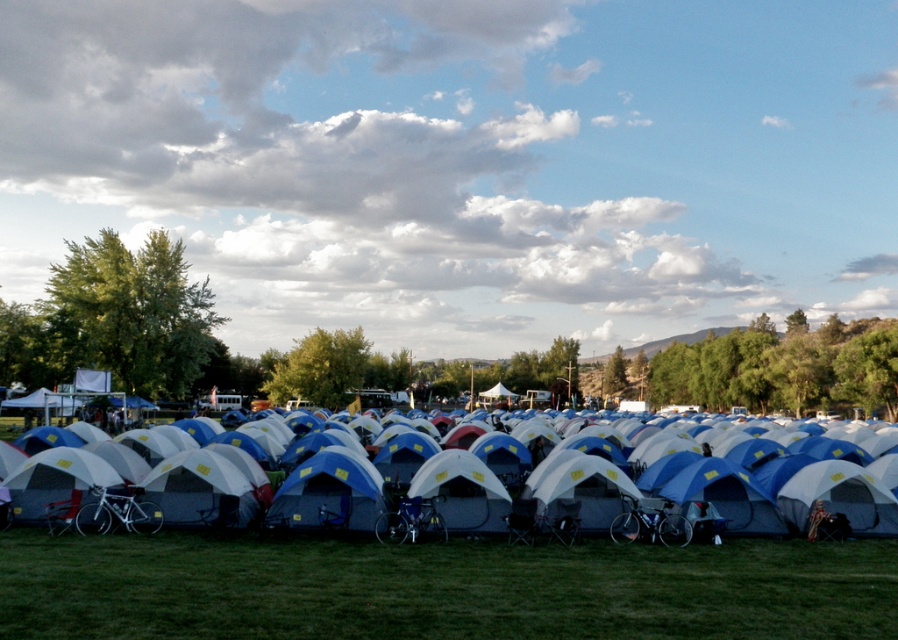
You are planning to set up a small picnic blanket in the camping area. Given the presence of the green grass at lower center and the white fabric tent at center, which area would be more suitable for placing the picnic blanket without obstructing the tents?

A: The green grass at lower center is more suitable because it has a smaller size compared to the white fabric tent at center, meaning there is enough space around it for the picnic blanket without blocking the tent.

You are a camper who just arrived at the site and want to set up your tent. You see the green grass at lower center and the white fabric tent at center. Which location is more suitable for placing your tent? Explain your reasoning based on the scene description.

The white fabric tent at center is already placed on the green grass at lower center. Since the grass is positioned over the tent, it suggests that the grass is covering the tent area, making it unsuitable for setting up another tent. Therefore, you should look for an open grassy spot not occupied by existing tents.

Consider the image. You are standing at the edge of the camping area and want to place a new tent. The tent requires a clear space of 3 meters by 3 meters on the green grass at lower center. Is there enough space available at the specified coordinates?

The green grass at lower center is located at point [439,588]. Since the grass area is part of the camping area with neatly arranged tents and parked bicycles, there might be limited space available. However, without specific information about the exact dimensions of the grass area or existing obstructions, it is not possible to confirm if a 3m x 3m space is available at the specified coordinates.